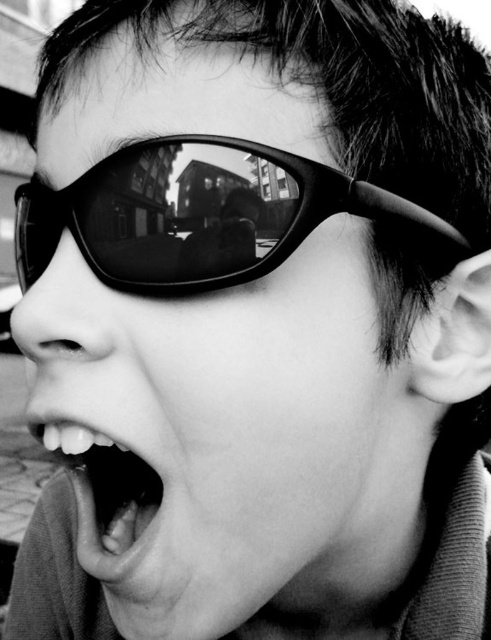
Question: Which object is closer to the camera taking this photo?

Choices:
 (A) smooth white teeth at center
 (B) black matte sunglasses at upper center

Answer: (B)

Question: Which point is closer to the camera?

Choices:
 (A) (190, 189)
 (B) (130, 547)

Answer: (A)

Question: Which point is closer to the camera taking this photo?

Choices:
 (A) (76, 214)
 (B) (98, 500)

Answer: (A)

Question: Does black matte sunglasses at upper center have a lesser width compared to smooth white teeth at center?

Choices:
 (A) no
 (B) yes

Answer: (A)

Question: Can you confirm if black matte sunglasses at upper center is positioned to the right of smooth white teeth at center?

Choices:
 (A) no
 (B) yes

Answer: (B)

Question: Considering the relative positions of black matte sunglasses at upper center and smooth white teeth at center in the image provided, where is black matte sunglasses at upper center located with respect to smooth white teeth at center?

Choices:
 (A) below
 (B) above

Answer: (B)